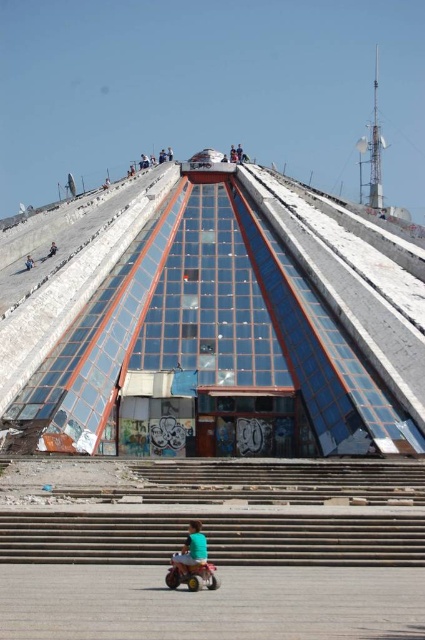
You are standing at the base of the pyramid building and want to take a photo of the point at coordinates (238,244). The camera you are using has a maximum focus range of 100 meters. Will the camera be able to focus on the point?

The distance between the point at coordinates (238,244) and the camera is 95.91 meters, which is within the camera maximum focus range of 100 meters. Therefore, the camera will be able to focus on the point.